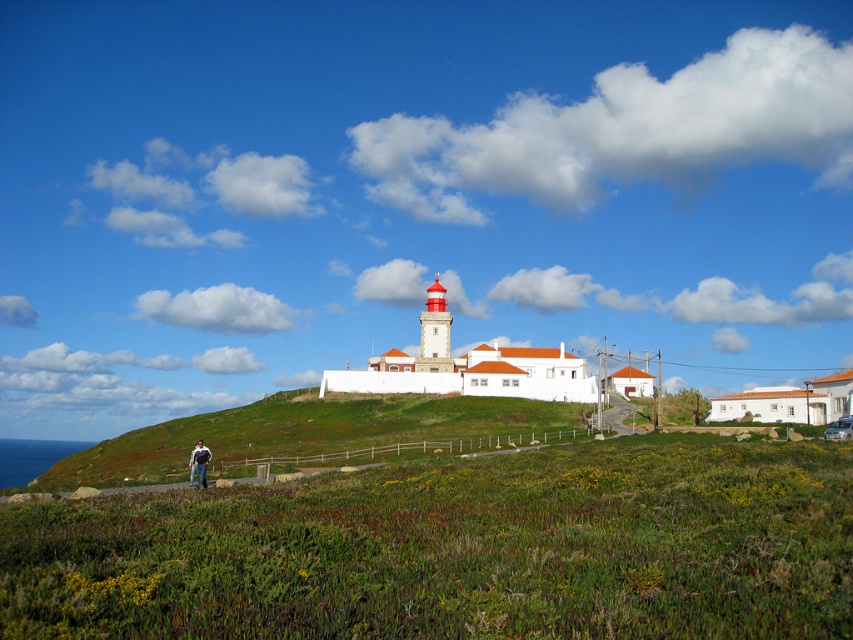
You are a GUI agent. You are given a task and a screenshot of the screen. Output one action in this format:
    pyautogui.click(x=<x>, y=<y>)
    Task: Click on the green grassy hillside at lower left
    
    Given the screenshot: What is the action you would take?
    (312, 433)

Is green grassy hillside at lower left positioned in front of blue jeans at lower left?

No, green grassy hillside at lower left is behind blue jeans at lower left.

Between point (335, 433) and point (202, 448), which one is positioned behind?

The point (335, 433) is behind.

The width and height of the screenshot is (853, 640). I want to click on green grassy hillside at lower left, so click(x=312, y=433).

Is point (169, 600) closer to camera compared to point (196, 458)?

That is True.

Is point (140, 605) positioned after point (200, 474)?

No, (140, 605) is in front of (200, 474).

In order to click on green grassy at lower left in this screenshot , I will do `click(457, 548)`.

Can you confirm if green grassy at lower left is positioned to the right of green grassy hillside at lower left?

Correct, you'll find green grassy at lower left to the right of green grassy hillside at lower left.

Find the location of a particular element. green grassy at lower left is located at coordinates (457, 548).

What do you see at coordinates (457, 548) in the screenshot?
I see `green grassy at lower left` at bounding box center [457, 548].

Identify the location of green grassy at lower left. The width and height of the screenshot is (853, 640). (457, 548).